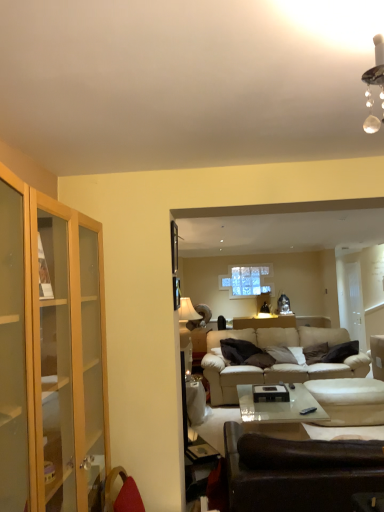
Question: Is beige leather couch at center, the first studio couch when ordered from back to front, taller than beige fabric armchair at right?

Choices:
 (A) yes
 (B) no

Answer: (A)

Question: Is beige fabric armchair at right inside beige leather couch at center, placed as the 2th studio couch when sorted from front to back?

Choices:
 (A) no
 (B) yes

Answer: (A)

Question: Is beige leather couch at center, the first studio couch when ordered from back to front, looking in the opposite direction of beige fabric armchair at right?

Choices:
 (A) no
 (B) yes

Answer: (A)

Question: Can we say beige leather couch at center, placed as the 2th studio couch when sorted from front to back, lies outside beige fabric armchair at right?

Choices:
 (A) yes
 (B) no

Answer: (A)

Question: Is the depth of beige leather couch at center, placed as the 2th studio couch when sorted from front to back, less than that of beige fabric armchair at right?

Choices:
 (A) yes
 (B) no

Answer: (A)

Question: From the image's perspective, does beige leather couch at center, placed as the 2th studio couch when sorted from front to back, appear higher than beige fabric armchair at right?

Choices:
 (A) yes
 (B) no

Answer: (A)

Question: Is the surface of beige fabric armchair at right in direct contact with beige fabric swivel chair at lower right?

Choices:
 (A) yes
 (B) no

Answer: (B)

Question: Can you confirm if beige fabric armchair at right is smaller than beige fabric swivel chair at lower right?

Choices:
 (A) yes
 (B) no

Answer: (A)

Question: From a real-world perspective, is beige fabric armchair at right physically below beige fabric swivel chair at lower right?

Choices:
 (A) yes
 (B) no

Answer: (B)

Question: Can you confirm if beige fabric armchair at right is thinner than beige fabric swivel chair at lower right?

Choices:
 (A) no
 (B) yes

Answer: (B)

Question: Does beige fabric armchair at right lie in front of beige fabric swivel chair at lower right?

Choices:
 (A) no
 (B) yes

Answer: (A)

Question: Does beige fabric armchair at right lie behind beige fabric swivel chair at lower right?

Choices:
 (A) no
 (B) yes

Answer: (B)

Question: Does dark gray fabric pillow at center appear on the right side of leather couch at lower right, which ranks as the 1th studio couch in front-to-back order?

Choices:
 (A) no
 (B) yes

Answer: (B)